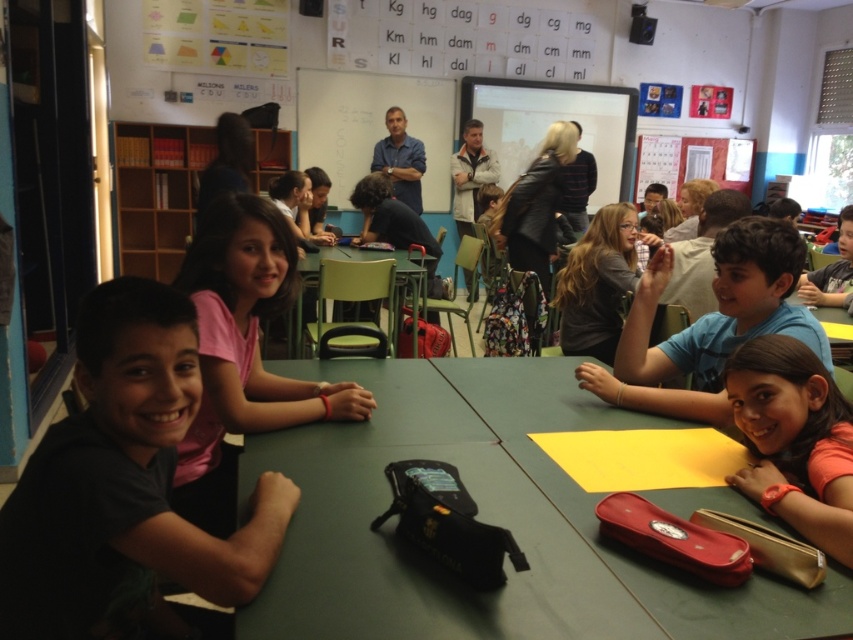
Question: Which object appears closest to the camera in this image?

Choices:
 (A) green matte table at center
 (B) blue cotton shirt at center

Answer: (A)

Question: Can you confirm if orange matte shirt at lower right is smaller than green plastic chair at center?

Choices:
 (A) yes
 (B) no

Answer: (A)

Question: Which object is the farthest from the blue cotton shirt at center?

Choices:
 (A) green plastic chair at center
 (B) orange matte shirt at lower right
 (C) matte blue shirt at center

Answer: (A)

Question: Is dark gray matte shirt at center below matte blue shirt at center?

Choices:
 (A) yes
 (B) no

Answer: (A)

Question: Does green matte table at center appear over orange matte shirt at lower right?

Choices:
 (A) yes
 (B) no

Answer: (B)

Question: Which of these objects is positioned farthest from the matte black backpack at center?

Choices:
 (A) blue cotton shirt at center
 (B) matte blue shirt at center
 (C) white matte whiteboard at upper center

Answer: (A)